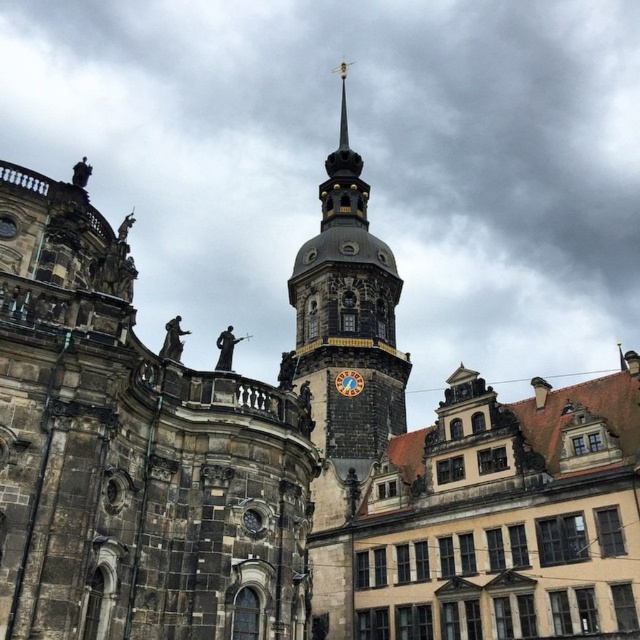
You are an architect designing a new pathway between the golden ornate clock tower at center and the matte brown clock at center. The pathway must be wide enough for a 12.5 meter long sculpture to pass through. Can the sculpture fit through the existing space between them?

The distance between the golden ornate clock tower at center and the matte brown clock at center is 13.10 meters, which is wider than the 12.5 meter long sculpture. Therefore, the sculpture can fit through the existing space between them.

You are standing at the entrance of the cathedral and want to locate the golden ornate clock tower at center. According to the architectural layout, where should you look relative to your position?

The golden ornate clock tower at center is located at point coordinates approximately 0.492 on the x axis and 0.545 on the y axis, so you should look towards the center area of the cathedral structure.

You are an architect examining the cathedral. You notice two clocks in the scene. The golden ornate clock tower at center and the matte brown clock at center. Which one is positioned higher up?

The golden ornate clock tower at center is located above the matte brown clock at center, so it is positioned higher up.